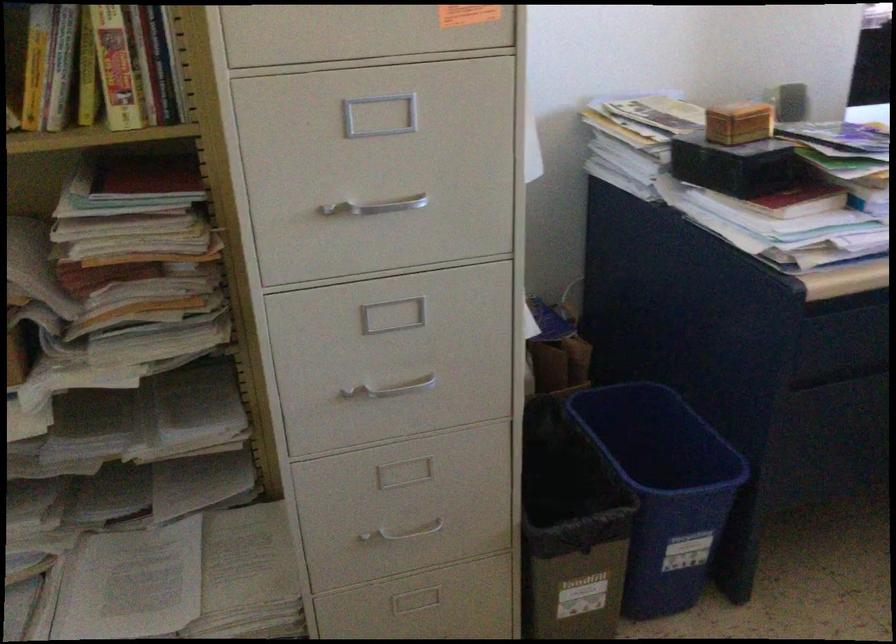
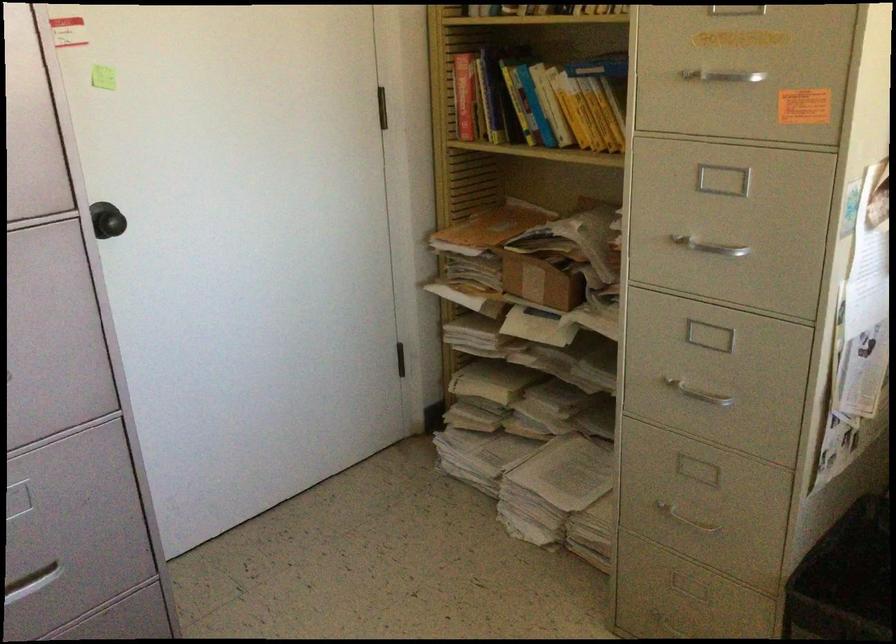
Locate, in the second image, the point that corresponds to [410,529] in the first image.

(684, 518)